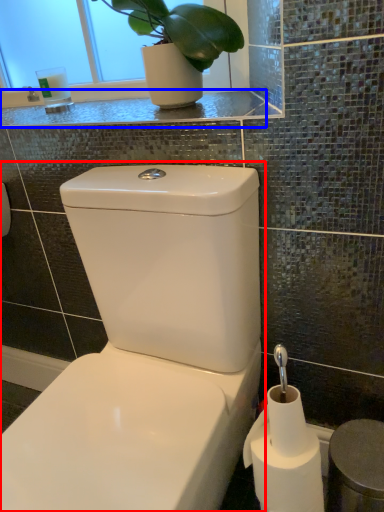
Question: Which of the following is the farthest to the observer, toilet (highlighted by a red box) or counter top (highlighted by a blue box)?

Choices:
 (A) toilet
 (B) counter top

Answer: (B)